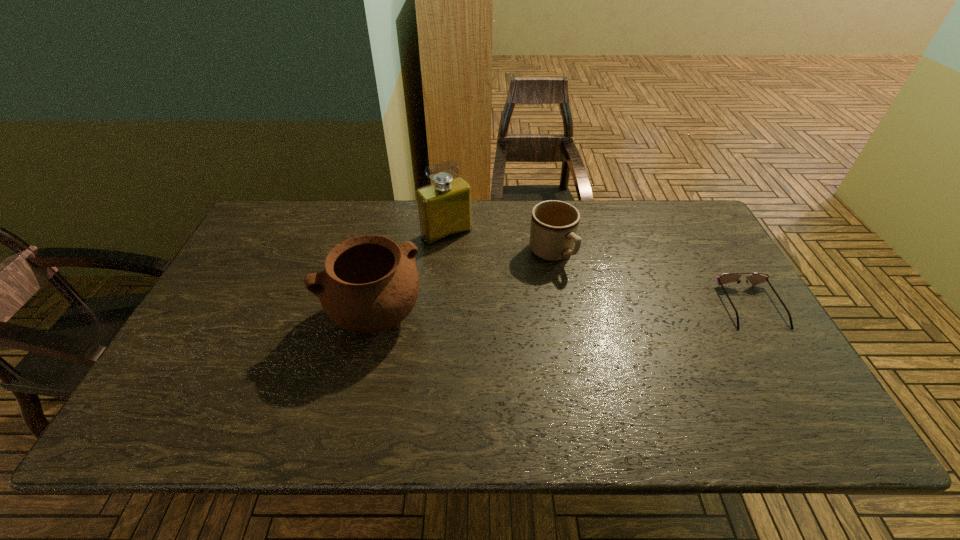
I want to click on pottery, so click(x=370, y=284).

Image resolution: width=960 pixels, height=540 pixels. What are the coordinates of `the rightmost object` in the screenshot? It's located at (755, 278).

Locate an element on the screen. The height and width of the screenshot is (540, 960). sunglasses is located at coordinates (755, 278).

Locate an element on the screen. Image resolution: width=960 pixels, height=540 pixels. the tallest object is located at coordinates (444, 208).

Find the location of `the third object from left to right`. the third object from left to right is located at coordinates (554, 224).

Identify the location of mug. The image size is (960, 540). (554, 224).

Find the location of a particular element. free location located 0.070m on the front of the third shortest object is located at coordinates (359, 379).

Where is `free space located on the bridge of the sunglasses`? This screenshot has height=540, width=960. free space located on the bridge of the sunglasses is located at coordinates (787, 367).

At what (x,y) coordinates should I click in order to perform the action: click on vacant area situated 0.240m on the front-facing side of the tallest object. Please return your answer as a coordinate pair (x, y). The image size is (960, 540). Looking at the image, I should click on (500, 294).

The width and height of the screenshot is (960, 540). In order to click on vacant space located on the front-facing side of the tallest object in this screenshot , I will do coord(525,322).